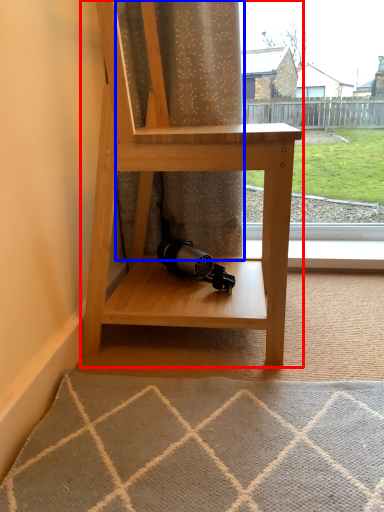
Question: Which object appears closest to the camera in this image, shelf (highlighted by a red box) or curtain (highlighted by a blue box)?

Choices:
 (A) shelf
 (B) curtain

Answer: (A)